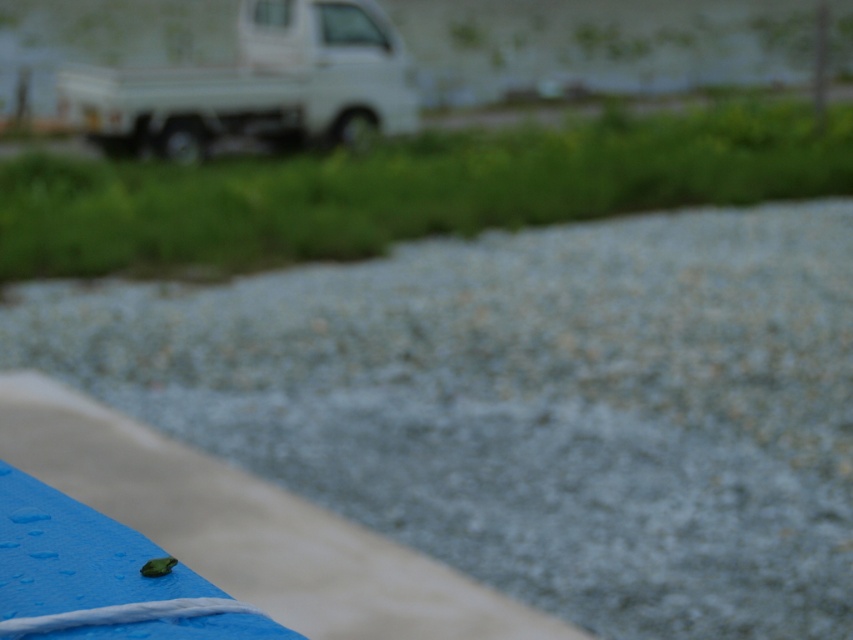
The image size is (853, 640). Describe the element at coordinates (531, 404) in the screenshot. I see `gray gravel at center` at that location.

Locate an element on the screen. This screenshot has height=640, width=853. gray gravel at center is located at coordinates (531, 404).